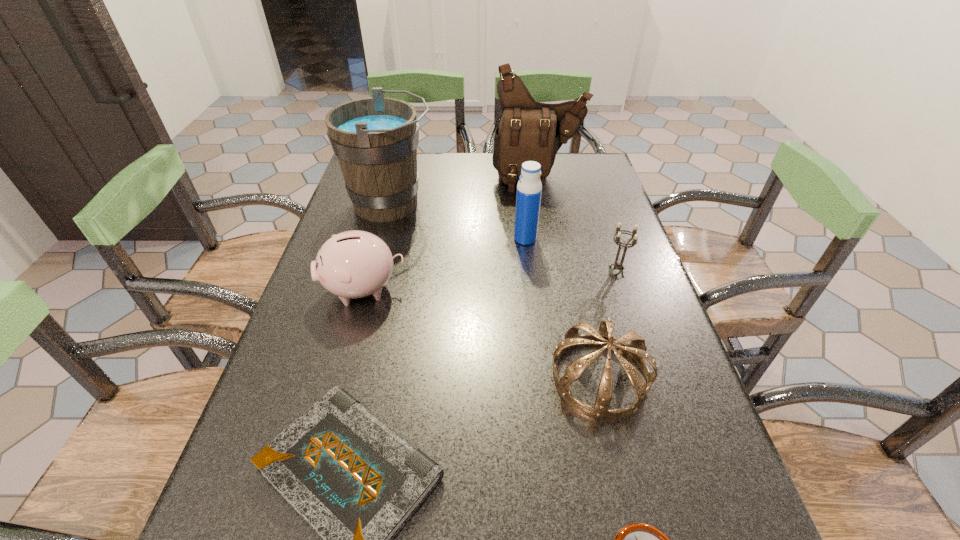
This screenshot has width=960, height=540. In order to click on object that is at the far left corner in this screenshot , I will do `click(375, 140)`.

The height and width of the screenshot is (540, 960). Identify the location of object located at the far right corner. (528, 130).

Locate an element on the screen. free space at the far edge of the desktop is located at coordinates (463, 181).

You are a GUI agent. You are given a task and a screenshot of the screen. Output one action in this format:
    pyautogui.click(x=<x>, y=<y>)
    Task: Click on the vacant space at the left edge
    This screenshot has width=960, height=540.
    Given the screenshot: What is the action you would take?
    pyautogui.click(x=308, y=329)

Locate an element on the screen. This screenshot has height=540, width=960. free space at the far right corner is located at coordinates (592, 156).

Locate an element on the screen. The height and width of the screenshot is (540, 960). vacant space that is in between the wine bucket and the candle holder is located at coordinates (504, 238).

Find the location of a particular element. empty space between the water bottle and the piggy bank is located at coordinates (444, 264).

Where is `vacant area that lies between the candle holder and the wine bucket`? The width and height of the screenshot is (960, 540). vacant area that lies between the candle holder and the wine bucket is located at coordinates (504, 238).

Where is `free space between the wine bucket and the shoulder bag`? free space between the wine bucket and the shoulder bag is located at coordinates (465, 191).

This screenshot has width=960, height=540. Find the location of `free area in between the water bottle and the piggy bank`. free area in between the water bottle and the piggy bank is located at coordinates (444, 264).